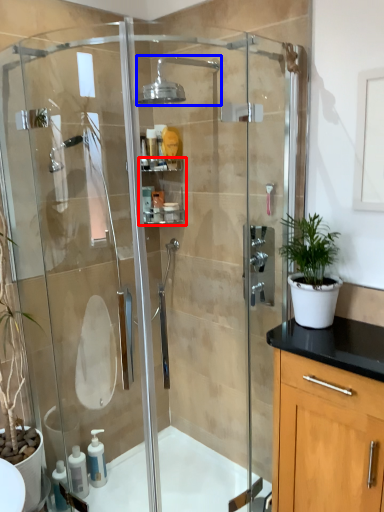
Question: Which of the following is the farthest to the observer, shelf (highlighted by a red box) or shower (highlighted by a blue box)?

Choices:
 (A) shelf
 (B) shower

Answer: (A)